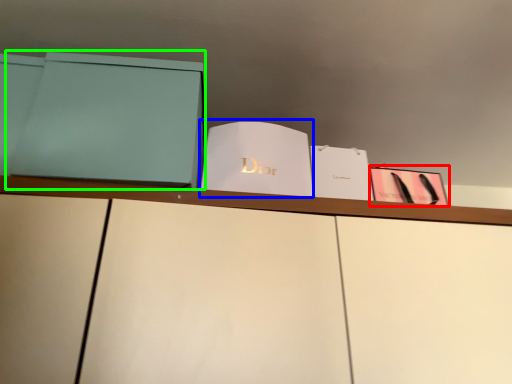
Question: Which object is the closest to the paperback book (highlighted by a red box)? Choose among these: paperback book (highlighted by a blue box) or paperback book (highlighted by a green box).

Choices:
 (A) paperback book
 (B) paperback book

Answer: (A)